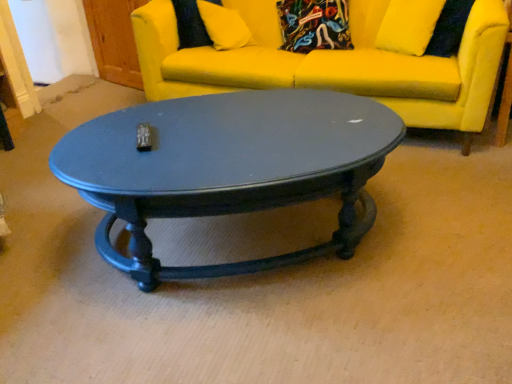
The image size is (512, 384). Describe the element at coordinates (227, 167) in the screenshot. I see `matte black coffee table at center` at that location.

The image size is (512, 384). Find the location of `matte black coffee table at center`. matte black coffee table at center is located at coordinates (227, 167).

Between matte black coffee table at center and yellow fabric pillow at upper center, which one is positioned behind?

Positioned behind is yellow fabric pillow at upper center.

From the image's perspective, is matte black coffee table at center located above or below yellow fabric pillow at upper center?

matte black coffee table at center is below yellow fabric pillow at upper center.

Is point (342, 219) positioned before point (226, 28)?

That is True.

How many degrees apart are the facing directions of matte black coffee table at center and yellow fabric pillow at upper center?

matte black coffee table at center and yellow fabric pillow at upper center are facing 38.2 degrees away from each other.

Is yellow fabric couch at upper center closer to camera compared to yellow fabric pillow at upper center?

Yes, yellow fabric couch at upper center is closer to the viewer.

Does point (467, 105) lie behind point (204, 20)?

No, it is not.

Find the location of a particular element. This screenshot has height=384, width=512. pillow above the yellow fabric couch at upper center (from the image's perspective) is located at coordinates (224, 26).

Which is more to the right, yellow fabric couch at upper center or matte black coffee table at center?

yellow fabric couch at upper center.

Is yellow fabric couch at upper center oriented away from matte black coffee table at center?

That's not correct — yellow fabric couch at upper center is not looking away from matte black coffee table at center.

Is yellow fabric couch at upper center taller or shorter than matte black coffee table at center?

Clearly, yellow fabric couch at upper center is taller compared to matte black coffee table at center.

From a real-world perspective, is yellow fabric couch at upper center above or below matte black coffee table at center?

From a real-world perspective, yellow fabric couch at upper center is physically above matte black coffee table at center.

What's the angular difference between matte black coffee table at center and yellow fabric couch at upper center's facing directions?

32.2 degrees.

Does matte black coffee table at center come in front of yellow fabric couch at upper center?

Yes, matte black coffee table at center is closer to the camera.

Is matte black coffee table at center turned away from yellow fabric couch at upper center?

Yes, yellow fabric couch at upper center is at the back of matte black coffee table at center.

Considering the sizes of yellow fabric pillow at upper center and yellow fabric couch at upper center in the image, is yellow fabric pillow at upper center taller or shorter than yellow fabric couch at upper center?

Considering their sizes, yellow fabric pillow at upper center has less height than yellow fabric couch at upper center.

From a real-world perspective, which object stands above the other?

yellow fabric pillow at upper center is physically above.

Are yellow fabric pillow at upper center and yellow fabric couch at upper center beside each other?

No, yellow fabric pillow at upper center is not with yellow fabric couch at upper center.

Identify the location of coffee table that is on the right side of yellow fabric pillow at upper center. (227, 167).

Is yellow fabric pillow at upper center oriented away from matte black coffee table at center?

That's not correct — yellow fabric pillow at upper center is not looking away from matte black coffee table at center.

Is the depth of yellow fabric pillow at upper center less than that of matte black coffee table at center?

No, the depth of yellow fabric pillow at upper center is greater than that of matte black coffee table at center.

Which is farther from the camera, (240, 27) or (135, 224)?

The point (240, 27) is farther.

Identify the location of pillow on the left of matte black coffee table at center. (224, 26).

This screenshot has width=512, height=384. Find the location of `pillow positioned vertically above the yellow fabric couch at upper center (from a real-world perspective)`. pillow positioned vertically above the yellow fabric couch at upper center (from a real-world perspective) is located at coordinates (224, 26).

Based on the photo, estimate the real-world distances between objects in this image. Which object is closer to yellow fabric pillow at upper center, matte black coffee table at center or yellow fabric couch at upper center?

Among the two, yellow fabric couch at upper center is located nearer to yellow fabric pillow at upper center.

Looking at the image, which one is located closer to yellow fabric couch at upper center, yellow fabric pillow at upper center or matte black coffee table at center?

yellow fabric pillow at upper center is closer to yellow fabric couch at upper center.

When comparing their distances from yellow fabric pillow at upper center, does yellow fabric couch at upper center or matte black coffee table at center seem closer?

Based on the image, yellow fabric couch at upper center appears to be nearer to yellow fabric pillow at upper center.

From the image, which object appears to be nearer to yellow fabric couch at upper center, matte black coffee table at center or yellow fabric pillow at upper center?

yellow fabric pillow at upper center lies closer to yellow fabric couch at upper center than the other object.

Based on the photo, based on their spatial positions, is yellow fabric couch at upper center or yellow fabric pillow at upper center closer to matte black coffee table at center?

yellow fabric couch at upper center.

From the image, which object appears to be nearer to matte black coffee table at center, yellow fabric pillow at upper center or yellow fabric couch at upper center?

Among the two, yellow fabric couch at upper center is located nearer to matte black coffee table at center.

The image size is (512, 384). What are the coordinates of `studio couch between matte black coffee table at center and yellow fabric pillow at upper center along the z-axis` in the screenshot? It's located at (332, 64).